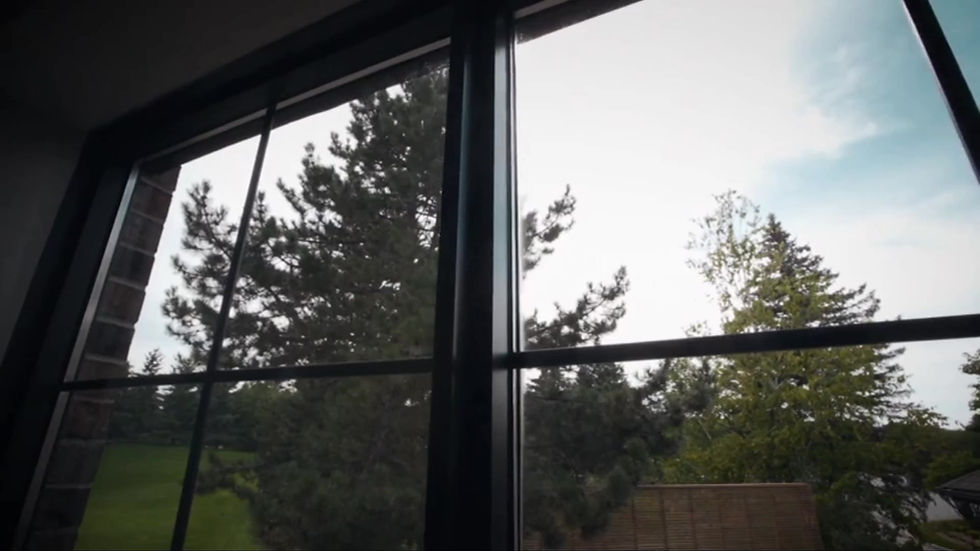
You are a GUI agent. You are given a task and a screenshot of the screen. Output one action in this format:
    pyautogui.click(x=<x>, y=<y>)
    Task: Click on the upper left corner of window
    The image size is (980, 551).
    Given the screenshot: What is the action you would take?
    pyautogui.click(x=135, y=165)